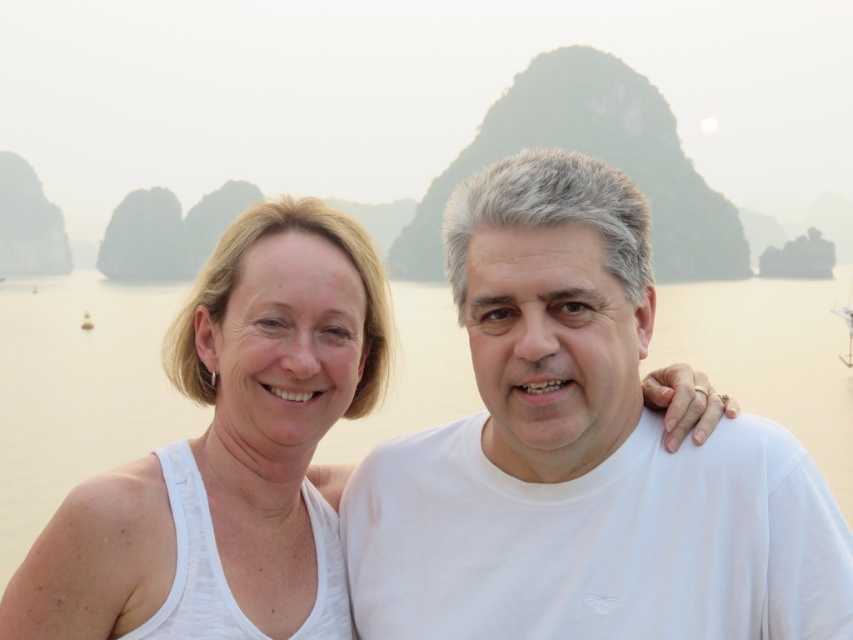
Question: Among these points, which one is nearest to the camera?

Choices:
 (A) (236, 524)
 (B) (602, 458)

Answer: (B)

Question: Is white cotton t-shirt at center positioned at the back of white cotton tank top at left?

Choices:
 (A) yes
 (B) no

Answer: (B)

Question: Can you confirm if white cotton t-shirt at center is thinner than white cotton tank top at left?

Choices:
 (A) yes
 (B) no

Answer: (B)

Question: Which object appears closest to the camera in this image?

Choices:
 (A) white cotton t-shirt at center
 (B) white cotton tank top at left

Answer: (A)

Question: Is white cotton t-shirt at center to the left of white cotton tank top at left from the viewer's perspective?

Choices:
 (A) yes
 (B) no

Answer: (B)